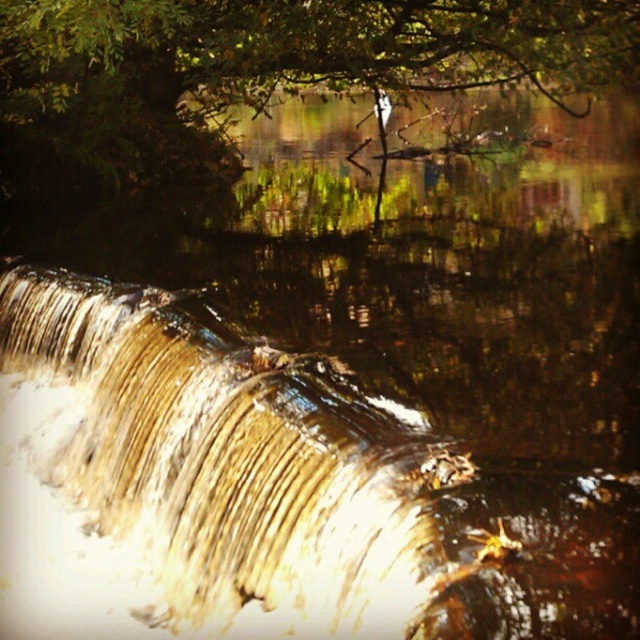
Question: Among these objects, which one is farthest from the camera?

Choices:
 (A) green leafy tree at upper center
 (B) golden smooth waterfall at center

Answer: (A)

Question: Which object is closer to the camera taking this photo?

Choices:
 (A) golden smooth waterfall at center
 (B) green leafy tree at upper center

Answer: (A)

Question: Where is golden smooth waterfall at center located in relation to green leafy tree at upper center in the image?

Choices:
 (A) right
 (B) left

Answer: (B)

Question: Can you confirm if golden smooth waterfall at center is positioned to the left of green leafy tree at upper center?

Choices:
 (A) no
 (B) yes

Answer: (B)

Question: Which object appears closest to the camera in this image?

Choices:
 (A) green leafy tree at upper center
 (B) golden smooth waterfall at center

Answer: (B)

Question: Does golden smooth waterfall at center have a larger size compared to green leafy tree at upper center?

Choices:
 (A) no
 (B) yes

Answer: (A)